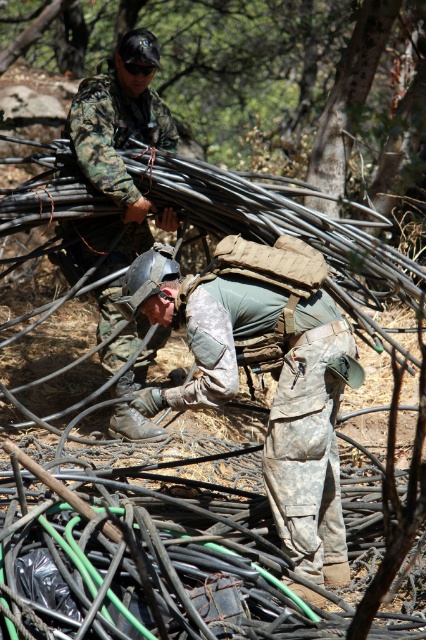
Which of these two, camouflage fabric helmet at center or camouflage fabric helmet at upper center, stands taller?

Standing taller between the two is camouflage fabric helmet at upper center.

Measure the distance between camouflage fabric helmet at center and camera.

They are 4.51 meters apart.

Which is in front, point (304, 483) or point (143, 140)?

Point (304, 483) is in front.

Locate an element on the screen. Image resolution: width=426 pixels, height=640 pixels. camouflage fabric helmet at center is located at coordinates (276, 385).